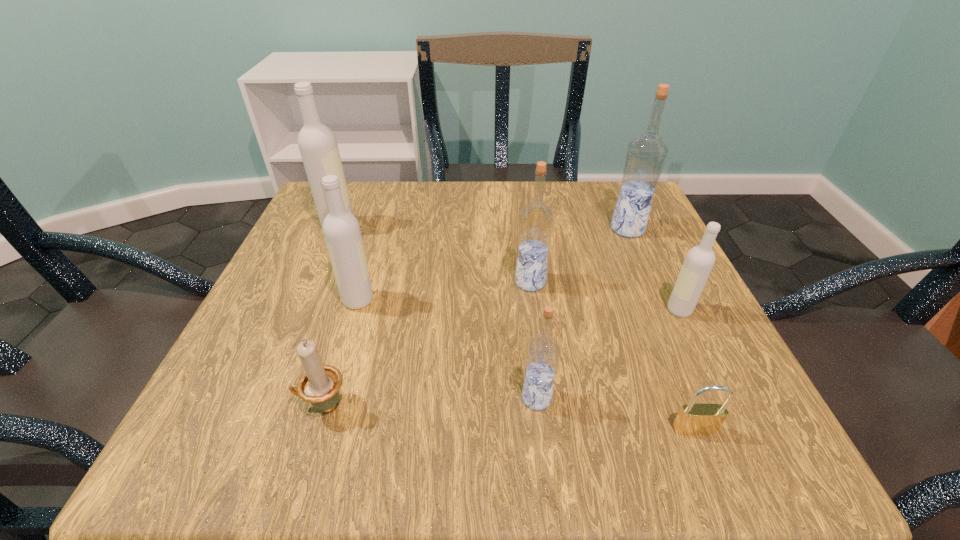
This screenshot has width=960, height=540. I want to click on the leftmost vodka, so [317, 143].

You are a GUI agent. You are given a task and a screenshot of the screen. Output one action in this format:
    pyautogui.click(x=<x>, y=<y>)
    Task: Click on the biggest white vodka
    The width and height of the screenshot is (960, 540).
    Given the screenshot: What is the action you would take?
    pyautogui.click(x=317, y=143)

The height and width of the screenshot is (540, 960). I want to click on the farthest blue vodka, so click(x=646, y=155).

This screenshot has width=960, height=540. Identify the location of the rightmost blue vodka. (646, 155).

The height and width of the screenshot is (540, 960). Find the location of `the second smallest white vodka`. the second smallest white vodka is located at coordinates [341, 229].

This screenshot has width=960, height=540. I want to click on the second white vodka from right to left, so click(341, 229).

The width and height of the screenshot is (960, 540). In order to click on the second farthest blue vodka in this screenshot , I will do `click(536, 220)`.

I want to click on the rightmost white vodka, so click(x=699, y=261).

Where is `the nearest blue vodka`? The height and width of the screenshot is (540, 960). the nearest blue vodka is located at coordinates (542, 355).

At what (x,y) coordinates should I click in order to perform the action: click on the nearest vodka. Please return your answer as a coordinate pair (x, y). The height and width of the screenshot is (540, 960). Looking at the image, I should click on click(542, 355).